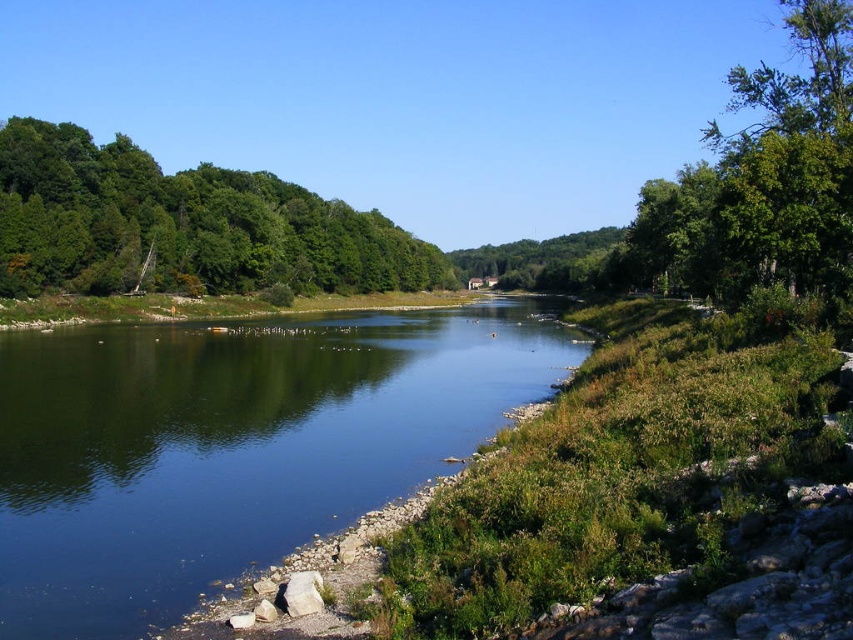
Question: Which object is positioned closest to the green smooth water at center?

Choices:
 (A) green leafy tree at upper right
 (B) green leafy tree at upper left

Answer: (A)

Question: Which point is closer to the camera taking this photo?

Choices:
 (A) (288, 237)
 (B) (712, 120)

Answer: (A)

Question: Where is green smooth water at center located in relation to green leafy tree at upper right in the image?

Choices:
 (A) left
 (B) right

Answer: (A)

Question: Which of these objects is positioned closest to the green smooth water at center?

Choices:
 (A) green leafy tree at upper right
 (B) green leafy tree at upper left

Answer: (A)

Question: Is green smooth water at center smaller than green leafy tree at upper left?

Choices:
 (A) yes
 (B) no

Answer: (A)

Question: Is the position of green leafy tree at upper left more distant than that of green leafy tree at upper right?

Choices:
 (A) no
 (B) yes

Answer: (B)